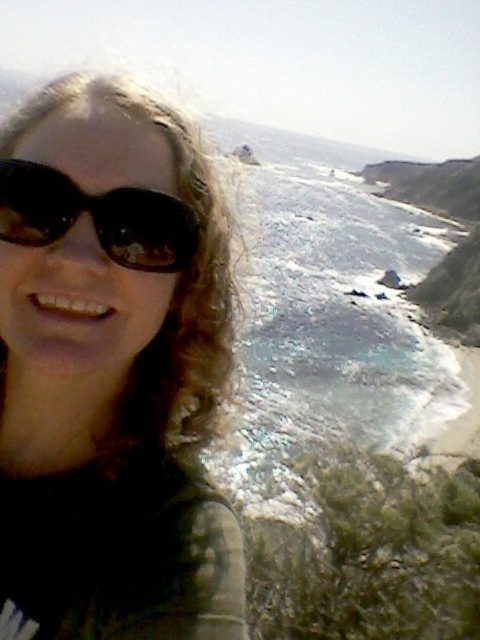
You are a photographer analyzing the composition of a selfie. The selfie includes a person with long curly blonde hair and two pairs of sunglasses labeled as matte black sunglasses at upper left and black matte sunglasses at upper left. Which sunglasses are positioned lower in the frame?

The matte black sunglasses at upper left are positioned lower than the black matte sunglasses at upper left in the frame.